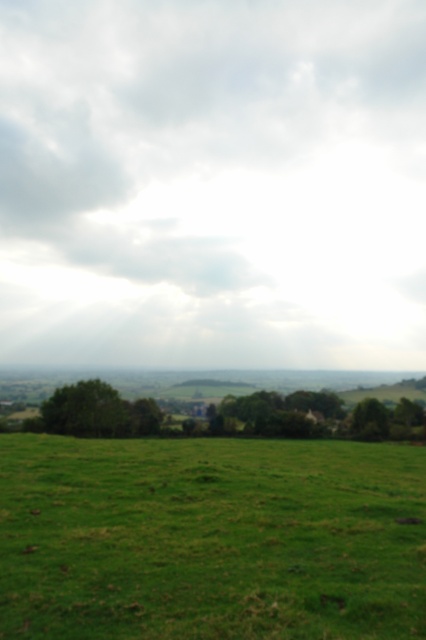
Consider the image. You are standing in the rural landscape and want to walk from the point closer to you to the point further away. Which path should you take between the two points, point (13, 61) and point (310, 484)?

You should walk from point (13, 61) to point (310, 484) because point (13, 61) is closer to you and point (310, 484) is further away.

You are standing in the rural landscape and looking at the sky. There is a point marked at coordinates (213, 182). What object is located at that point?

The point at (213, 182) marks a white fluffy cloud at upper center.